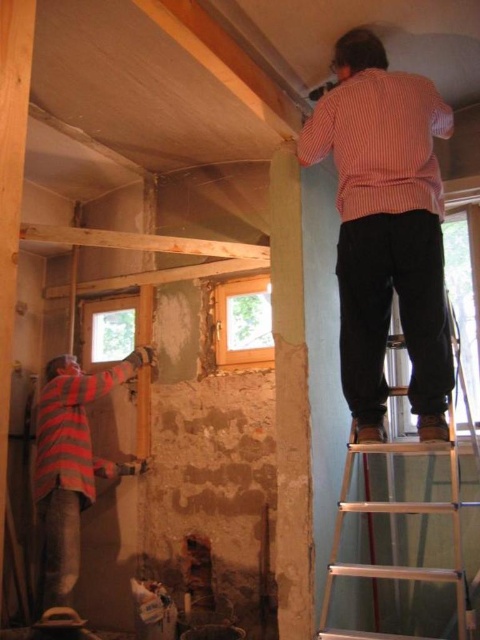
Question: Is striped cotton shirt at upper right above striped fabric construction worker at lower left?

Choices:
 (A) no
 (B) yes

Answer: (B)

Question: Based on their relative distances, which object is farther from the silver metallic ladder at upper right?

Choices:
 (A) striped cotton shirt at upper right
 (B) striped fabric construction worker at lower left

Answer: (B)

Question: Does striped fabric construction worker at lower left have a greater width compared to silver metallic ladder at upper right?

Choices:
 (A) yes
 (B) no

Answer: (B)

Question: Which point appears closest to the camera in this image?

Choices:
 (A) (371, 193)
 (B) (84, 452)

Answer: (A)

Question: Is striped cotton shirt at upper right positioned at the back of striped fabric construction worker at lower left?

Choices:
 (A) yes
 (B) no

Answer: (B)

Question: Which object is closer to the camera taking this photo?

Choices:
 (A) striped cotton shirt at upper right
 (B) silver metallic ladder at upper right
 (C) striped fabric construction worker at lower left

Answer: (B)